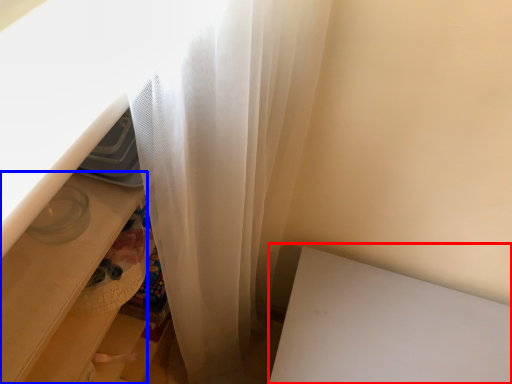
Question: Which of the following is the farthest to the observer, table (highlighted by a red box) or drawer (highlighted by a blue box)?

Choices:
 (A) table
 (B) drawer

Answer: (A)